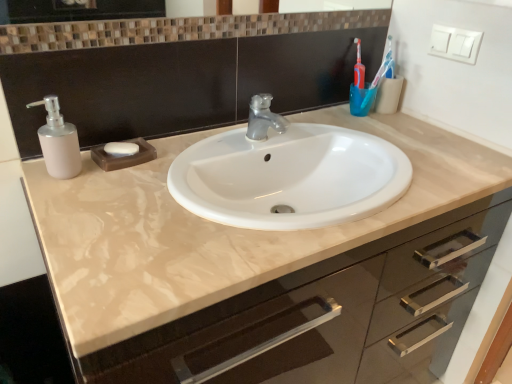
Question: From their relative heights in the image, would you say blue plastic toothbrush at upper right is taller or shorter than brown mosaic tile mirror at upper center?

Choices:
 (A) short
 (B) tall

Answer: (B)

Question: Does point (367, 99) appear closer or farther from the camera than point (123, 8)?

Choices:
 (A) farther
 (B) closer

Answer: (A)

Question: Which is farther from the blue plastic toothbrush at upper right?

Choices:
 (A) white matte soap at center
 (B) matte beige cabinet at center
 (C) matte white soap dispenser at left
 (D) brown mosaic tile mirror at upper center

Answer: (C)

Question: Estimate the real-world distances between objects in this image. Which object is farther from the matte white soap dispenser at left?

Choices:
 (A) blue plastic toothbrush at upper right
 (B) matte beige cabinet at center
 (C) white matte soap at center
 (D) brown mosaic tile mirror at upper center

Answer: (A)